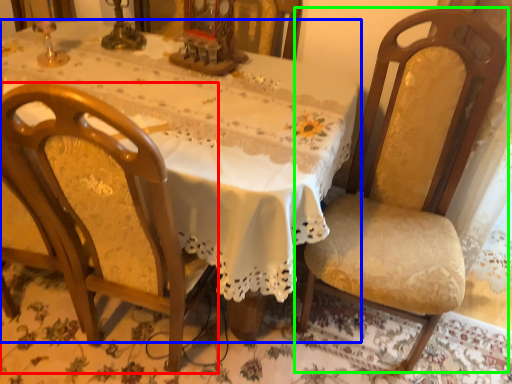
Question: Estimate the real-world distances between objects in this image. Which object is farther from chair (highlighted by a red box), table (highlighted by a blue box) or chair (highlighted by a green box)?

Choices:
 (A) table
 (B) chair

Answer: (B)